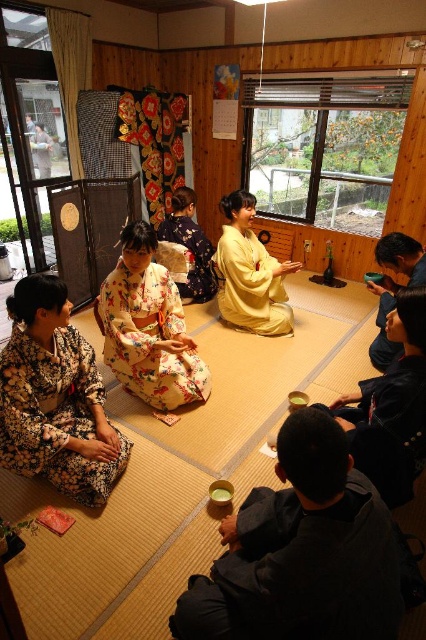
You are a guest at the tea ceremony and need to find the hostess. You see the floral kimono at lower left and the yellow silk kimono at center. Which one is closer to you?

The floral kimono at lower left is in front of the yellow silk kimono at center, so the floral kimono at lower left is closer to you.

You are an assistant at the tea ceremony and need to ensure all kimonos are displayed properly. Which kimono, the floral silk kimono at center or the floral kimono at center, has a wider width?

The floral silk kimono at center is wider than the floral kimono at center according to the description.

You are a guest sitting in the traditional Japanese tea ceremony room. You notice two points marked in the scene. Which point is closer to you, point (x=284, y=534) or point (x=399, y=349)?

Point (x=284, y=534) is closer to the viewer than point (x=399, y=349).